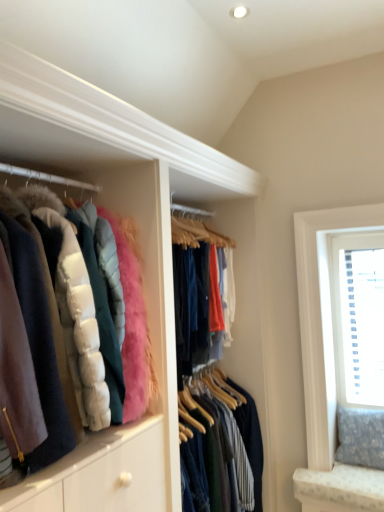
What do you see at coordinates (358, 318) in the screenshot? I see `white textured blinds at upper right` at bounding box center [358, 318].

Based on the photo, what is the approximate height of white textured blinds at upper right?

white textured blinds at upper right is 1.21 meters tall.

At what (x,y) coordinates should I click in order to perform the action: click on white textured blinds at upper right. Please return your answer as a coordinate pair (x, y). Looking at the image, I should click on (358, 318).

What do you see at coordinates (77, 307) in the screenshot? I see `velvet-like pink puffer jacket at left` at bounding box center [77, 307].

Where is `velvet-like pink puffer jacket at left`? velvet-like pink puffer jacket at left is located at coordinates (77, 307).

This screenshot has height=512, width=384. Identify the location of white textured blinds at upper right. (358, 318).

In the image, is velvet-like pink puffer jacket at left on the left side or the right side of white textured blinds at upper right?

From the image, it's evident that velvet-like pink puffer jacket at left is to the left of white textured blinds at upper right.

Who is more distant, velvet-like pink puffer jacket at left or white textured blinds at upper right?

white textured blinds at upper right is further from the camera.

Is point (100, 285) farther from viewer compared to point (360, 364)?

That is False.

From the image's perspective, is velvet-like pink puffer jacket at left located above white textured blinds at upper right?

Yes, from the image's perspective, velvet-like pink puffer jacket at left is over white textured blinds at upper right.

From a real-world perspective, is velvet-like pink puffer jacket at left below white textured blinds at upper right?

No, from a real-world perspective, velvet-like pink puffer jacket at left is not beneath white textured blinds at upper right.

Considering the relative sizes of velvet-like pink puffer jacket at left and white textured blinds at upper right in the image provided, is velvet-like pink puffer jacket at left wider than white textured blinds at upper right?

Indeed, velvet-like pink puffer jacket at left has a greater width compared to white textured blinds at upper right.

Can you confirm if velvet-like pink puffer jacket at left is shorter than white textured blinds at upper right?

Yes.

Is velvet-like pink puffer jacket at left bigger than white textured blinds at upper right?

Correct, velvet-like pink puffer jacket at left is larger in size than white textured blinds at upper right.

Is velvet-like pink puffer jacket at left inside or outside of white textured blinds at upper right?

velvet-like pink puffer jacket at left is outside white textured blinds at upper right.

Would you say velvet-like pink puffer jacket at left is a long distance from white textured blinds at upper right?

Absolutely, velvet-like pink puffer jacket at left is distant from white textured blinds at upper right.

Is velvet-like pink puffer jacket at left looking in the opposite direction of white textured blinds at upper right?

That's not correct — velvet-like pink puffer jacket at left is not looking away from white textured blinds at upper right.

Locate an element on the screen. The height and width of the screenshot is (512, 384). jacket that is above the white textured blinds at upper right (from the image's perspective) is located at coordinates (77, 307).

Looking at this image, is white textured blinds at upper right at the left side of velvet-like pink puffer jacket at left?

In fact, white textured blinds at upper right is to the right of velvet-like pink puffer jacket at left.

From the picture: Is the position of white textured blinds at upper right less distant than that of velvet-like pink puffer jacket at left?

No, the depth of white textured blinds at upper right is greater than that of velvet-like pink puffer jacket at left.

Is point (373, 289) closer to camera compared to point (95, 282)?

That is False.

From the picture: From the image's perspective, is white textured blinds at upper right below velvet-like pink puffer jacket at left?

Answer: Yes, from the image's perspective, white textured blinds at upper right is beneath velvet-like pink puffer jacket at left.

From a real-world perspective, between white textured blinds at upper right and velvet-like pink puffer jacket at left, who is vertically lower?

white textured blinds at upper right.

Considering the sizes of objects white textured blinds at upper right and velvet-like pink puffer jacket at left in the image provided, who is thinner, white textured blinds at upper right or velvet-like pink puffer jacket at left?

white textured blinds at upper right.

Who is shorter, white textured blinds at upper right or velvet-like pink puffer jacket at left?

velvet-like pink puffer jacket at left is shorter.

In the scene shown: Considering the relative sizes of white textured blinds at upper right and velvet-like pink puffer jacket at left in the image provided, is white textured blinds at upper right bigger than velvet-like pink puffer jacket at left?

Incorrect, white textured blinds at upper right is not larger than velvet-like pink puffer jacket at left.

Would you say white textured blinds at upper right is inside or outside velvet-like pink puffer jacket at left?

white textured blinds at upper right is not inside velvet-like pink puffer jacket at left, it's outside.

Is white textured blinds at upper right touching velvet-like pink puffer jacket at left?

No, white textured blinds at upper right is not in contact with velvet-like pink puffer jacket at left.

Could you tell me if white textured blinds at upper right is turned towards velvet-like pink puffer jacket at left?

No, white textured blinds at upper right is not oriented towards velvet-like pink puffer jacket at left.

What's the angular difference between white textured blinds at upper right and velvet-like pink puffer jacket at left's facing directions?

They differ by 88.7 degrees in their facing directions.

Measure the distance from white textured blinds at upper right to velvet-like pink puffer jacket at left.

The distance of white textured blinds at upper right from velvet-like pink puffer jacket at left is 6.00 feet.

Identify the location of window on the right of the velvet-like pink puffer jacket at left. This screenshot has height=512, width=384. (358, 318).

I want to click on jacket on the left of white textured blinds at upper right, so click(77, 307).

I want to click on jacket in front of the white textured blinds at upper right, so pyautogui.click(x=77, y=307).